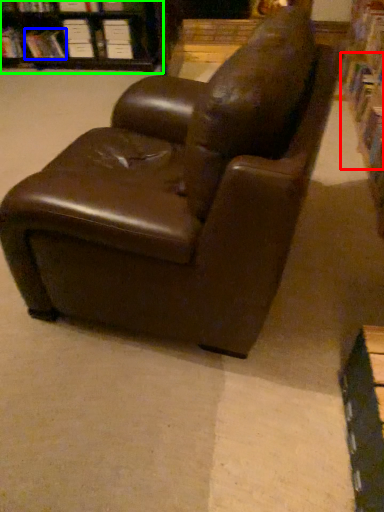
Question: Based on their relative distances, which object is nearer to book (highlighted by a red box)? Choose from book (highlighted by a blue box) and bookcase (highlighted by a green box).

Choices:
 (A) book
 (B) bookcase

Answer: (B)